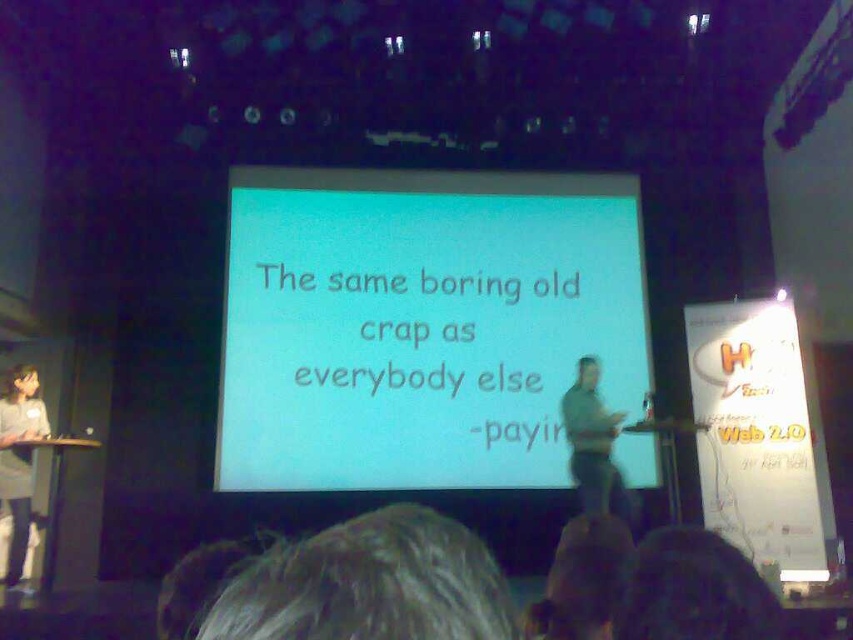
What do you see at coordinates (593, 444) in the screenshot? The width and height of the screenshot is (853, 640). I see `green fabric shirt at center` at bounding box center [593, 444].

Locate an element on the screen. The image size is (853, 640). green fabric shirt at center is located at coordinates (593, 444).

Which of these two, white matte projection screen at center or green fabric shirt at center, stands taller?

white matte projection screen at center is taller.

Describe the element at coordinates (421, 324) in the screenshot. I see `white matte projection screen at center` at that location.

Which is behind, point (254, 456) or point (590, 394)?

The point (254, 456) is more distant.

Locate an element on the screen. Image resolution: width=853 pixels, height=640 pixels. white matte projection screen at center is located at coordinates (421, 324).

From the picture: Who is positioned more to the left, white matte projection screen at center or gray fabric shirt at left?

Positioned to the left is gray fabric shirt at left.

Who is positioned more to the right, white matte projection screen at center or gray fabric shirt at left?

white matte projection screen at center is more to the right.

This screenshot has height=640, width=853. In order to click on white matte projection screen at center in this screenshot , I will do `click(421, 324)`.

Identify the location of white matte projection screen at center. (421, 324).